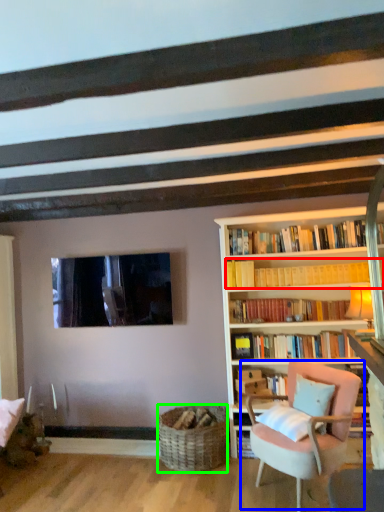
Question: Considering the real-world distances, which object is farthest from book (highlighted by a red box)? chair (highlighted by a blue box) or basket (highlighted by a green box)?

Choices:
 (A) chair
 (B) basket

Answer: (B)